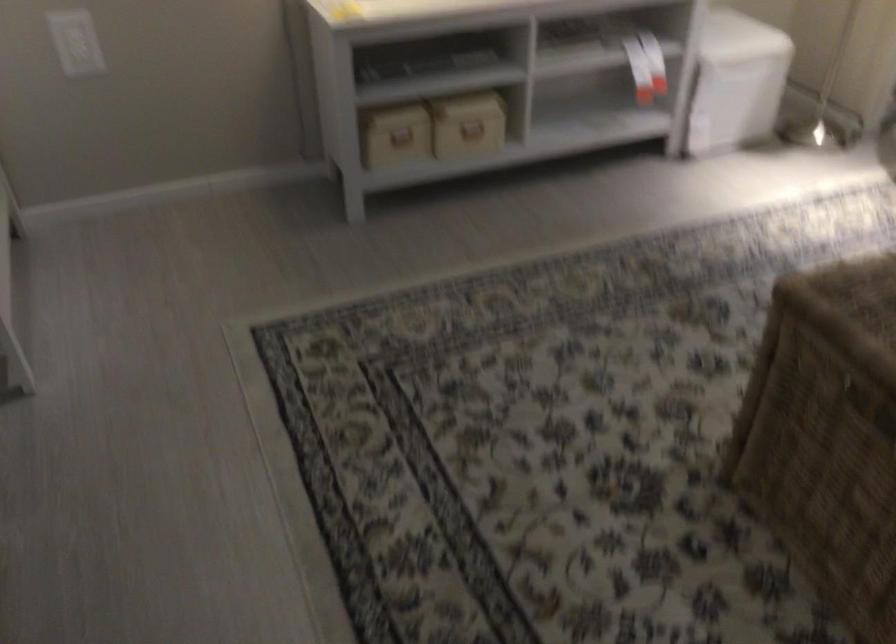
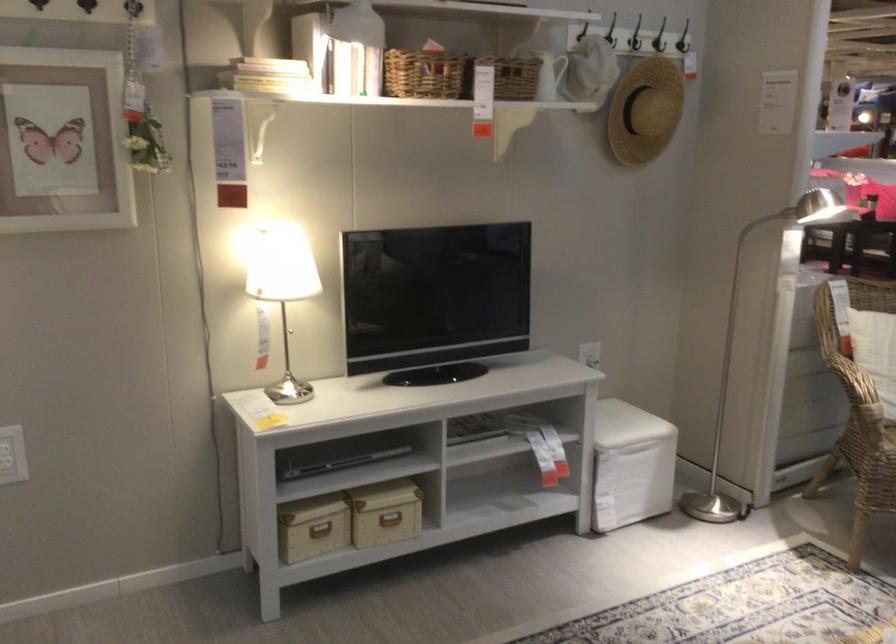
Which direction would the cameraman need to move to produce the second image?

The cameraman walked toward left, backward.